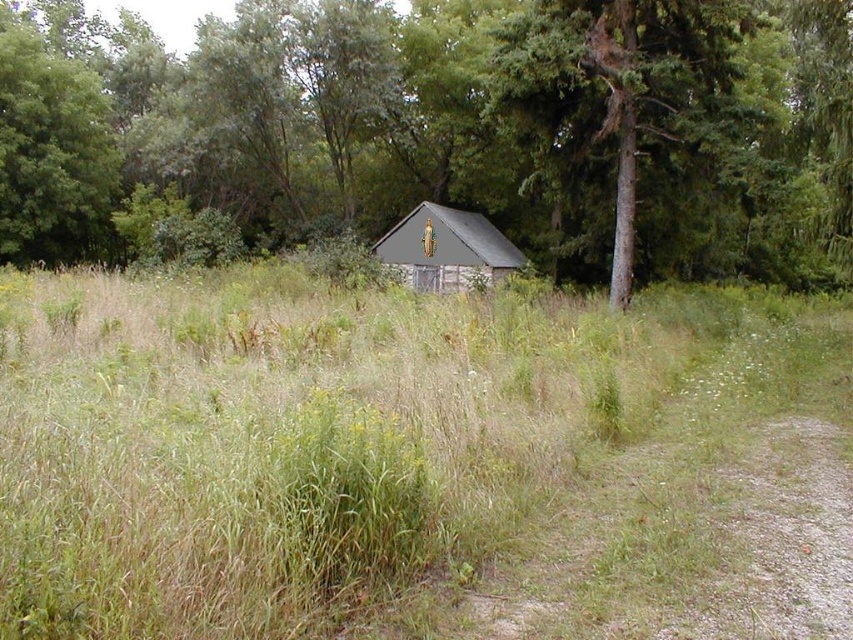
Question: In this image, where is green grassy at center located relative to brown wood tree at center?

Choices:
 (A) left
 (B) right

Answer: (B)

Question: Which of the following is the closest to the observer?

Choices:
 (A) (601, 227)
 (B) (293, 502)

Answer: (B)

Question: Is green grassy at center thinner than brown wood tree at center?

Choices:
 (A) no
 (B) yes

Answer: (B)

Question: Among these objects, which one is nearest to the camera?

Choices:
 (A) green grassy at center
 (B) brown wood tree at center

Answer: (A)

Question: Is green grassy at center further to the viewer compared to brown wood tree at center?

Choices:
 (A) no
 (B) yes

Answer: (A)